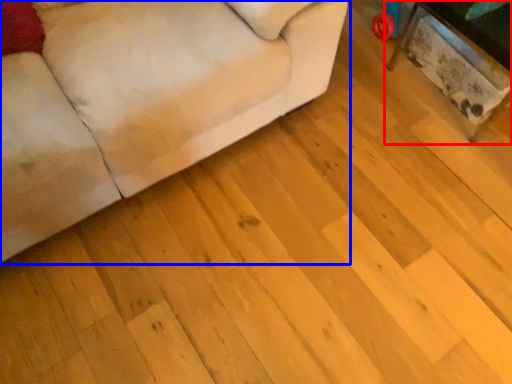
Question: Which point is closer to the camera, table (highlighted by a red box) or studio couch (highlighted by a blue box)?

Choices:
 (A) table
 (B) studio couch

Answer: (B)